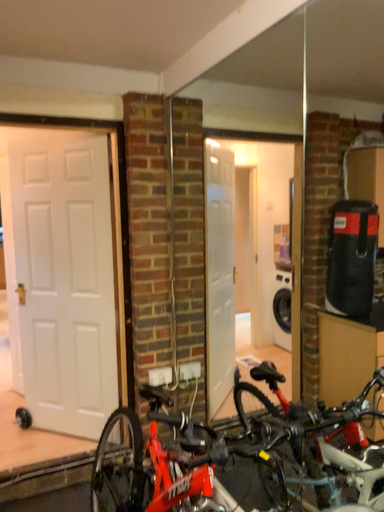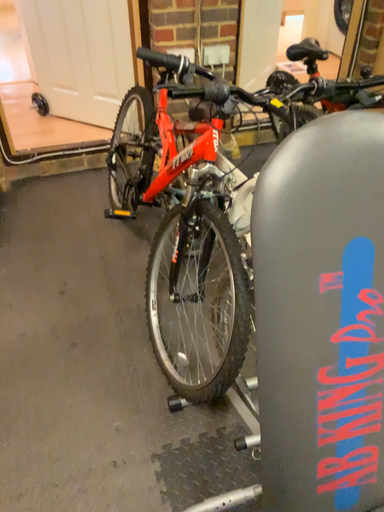
Question: Which way did the camera rotate in the video?

Choices:
 (A) rotated upward
 (B) rotated downward

Answer: (B)